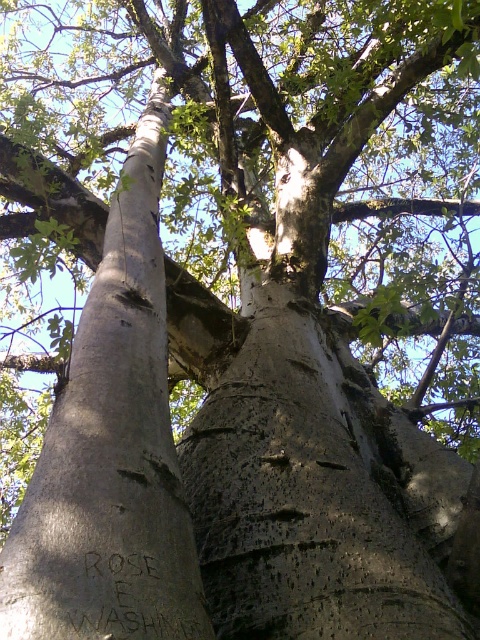
Question: Does smooth gray bark at center have a larger size compared to black carved writing at lower center?

Choices:
 (A) no
 (B) yes

Answer: (B)

Question: Is smooth gray bark at center further to the viewer compared to black carved writing at lower center?

Choices:
 (A) yes
 (B) no

Answer: (B)

Question: Is smooth gray bark at center smaller than black carved writing at lower center?

Choices:
 (A) yes
 (B) no

Answer: (B)